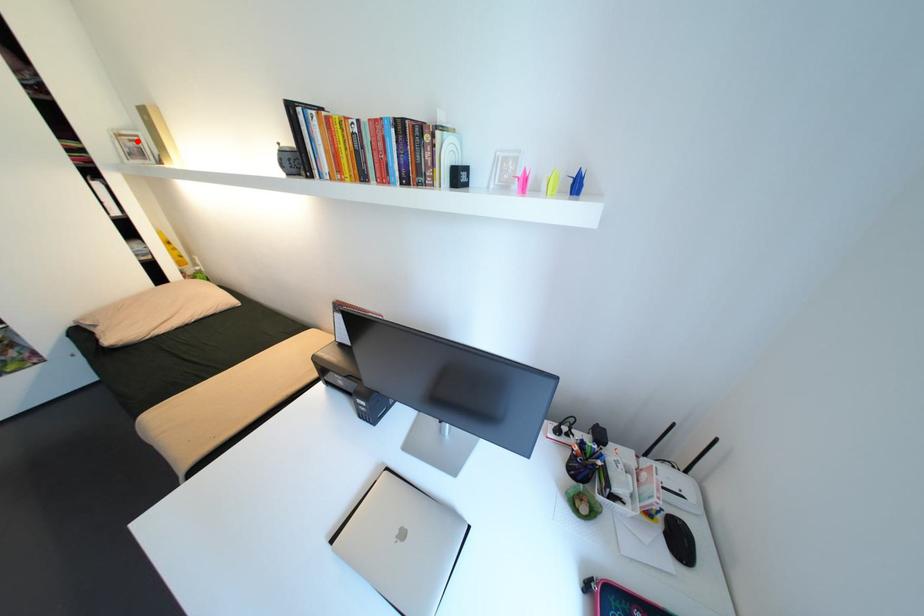
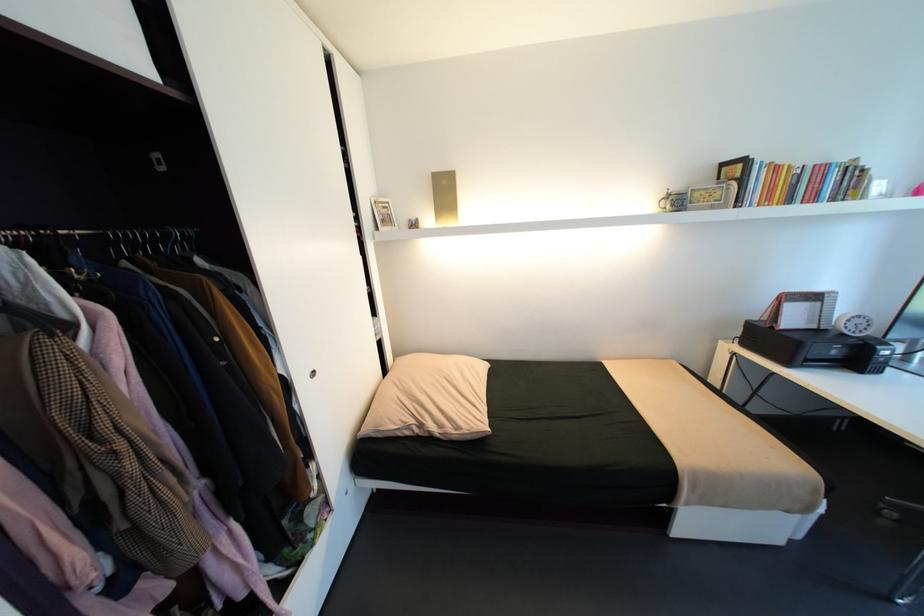
In the second image, find the point that corresponds to the highlighted location in the first image.

(392, 208)